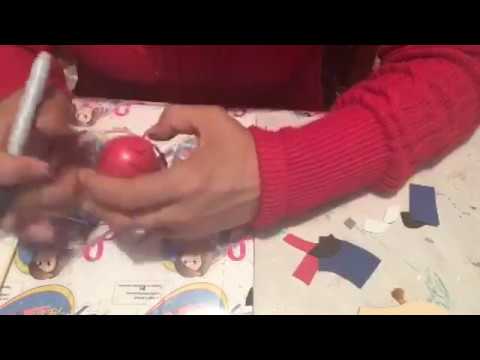
You are a GUI agent. You are given a task and a screenshot of the screen. Output one action in this format:
    pyautogui.click(x=<x>, y=<y>)
    Task: Click on the book
    This screenshot has width=480, height=360.
    Given the screenshot: What is the action you would take?
    pyautogui.click(x=95, y=286)